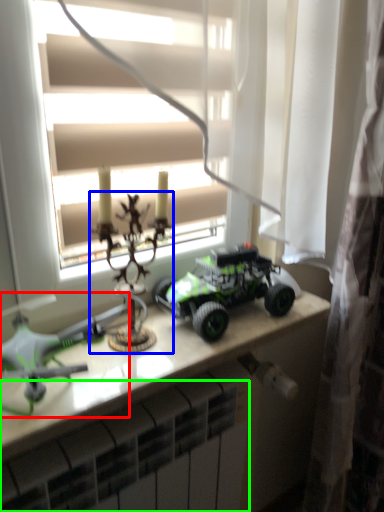
Question: Which is nearer to the toy (highlighted by a red box)? toy (highlighted by a blue box) or radiator (highlighted by a green box).

Choices:
 (A) toy
 (B) radiator

Answer: (A)